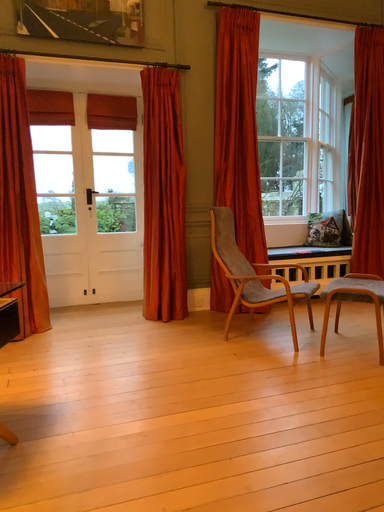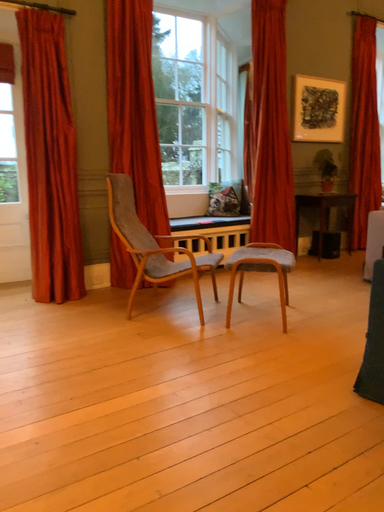
Question: How did the camera likely rotate when shooting the video?

Choices:
 (A) rotated right
 (B) rotated left

Answer: (A)